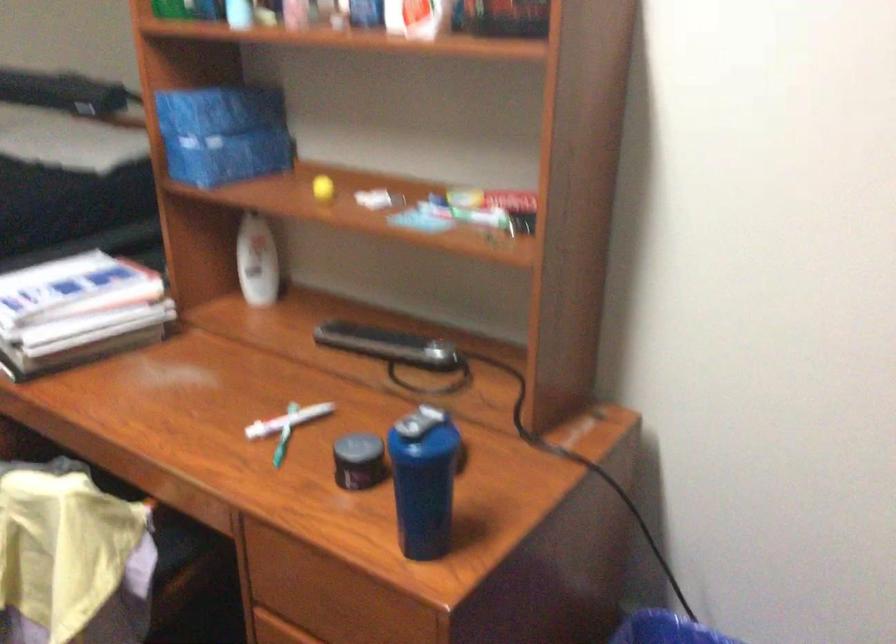
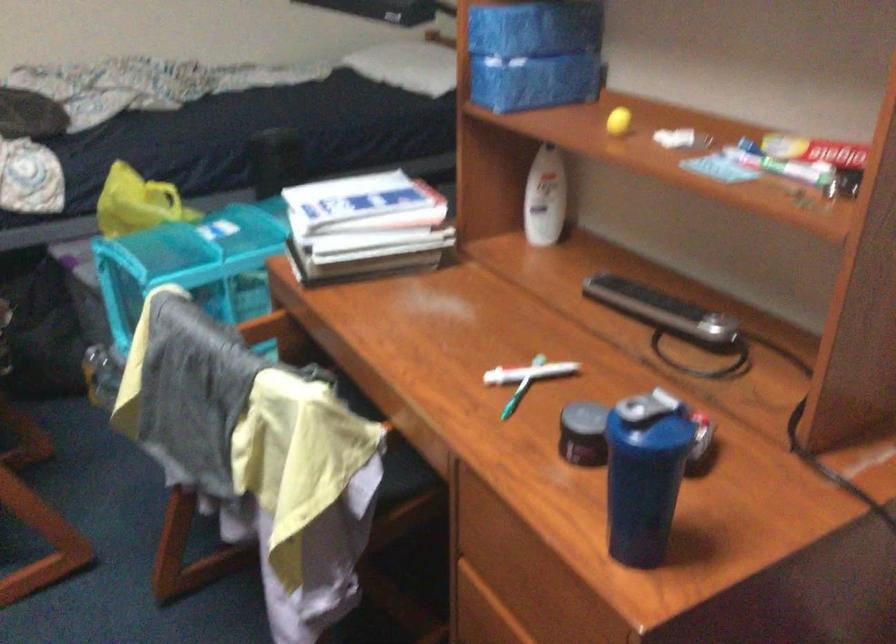
Where in the second image is the point corresponding to [425,427] from the first image?

(650, 410)